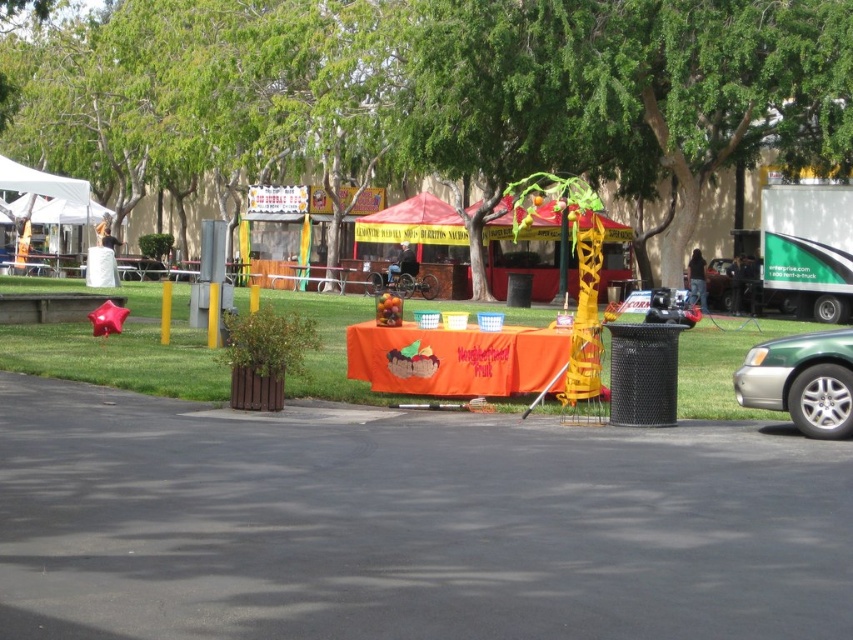
Question: Where is green leafy tree at center located in relation to green metallic car at lower right in the image?

Choices:
 (A) below
 (B) above

Answer: (B)

Question: Is green leafy tree at center positioned in front of green metallic car at lower right?

Choices:
 (A) no
 (B) yes

Answer: (A)

Question: Is green leafy tree at center positioned in front of green metallic car at lower right?

Choices:
 (A) no
 (B) yes

Answer: (A)

Question: Among these points, which one is nearest to the camera?

Choices:
 (A) (370, 28)
 (B) (782, 374)

Answer: (B)

Question: Which of the following is the closest to the observer?

Choices:
 (A) green leafy tree at center
 (B) green metallic car at lower right

Answer: (B)

Question: Which point is farther to the camera?

Choices:
 (A) (485, 131)
 (B) (775, 340)

Answer: (A)